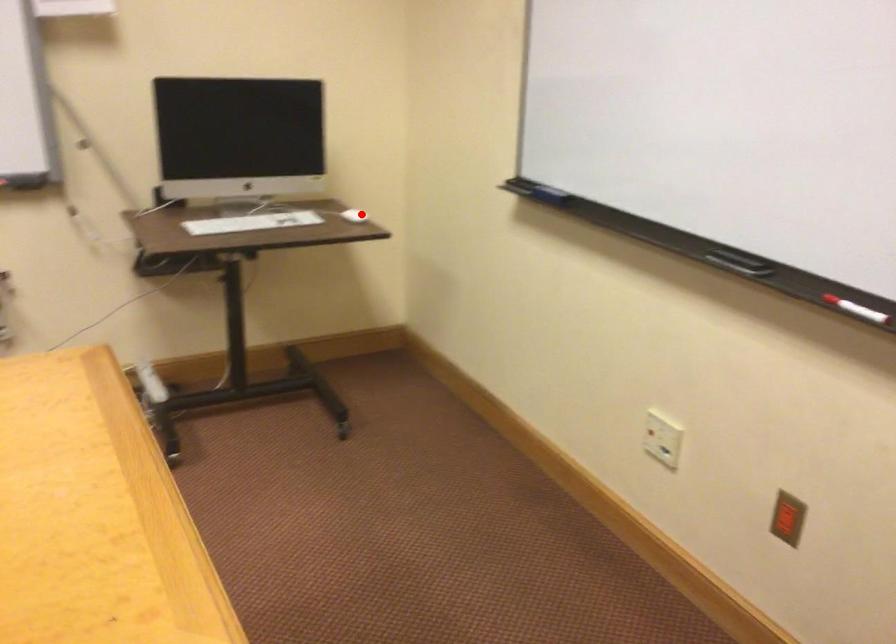
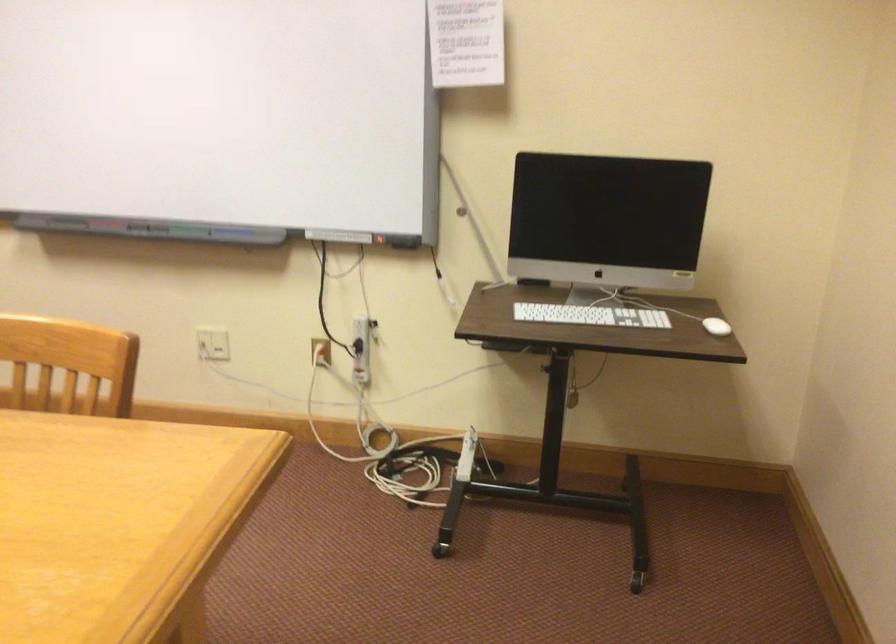
Where in the second image is the point corresponding to the highlighted location from the first image?

(716, 326)